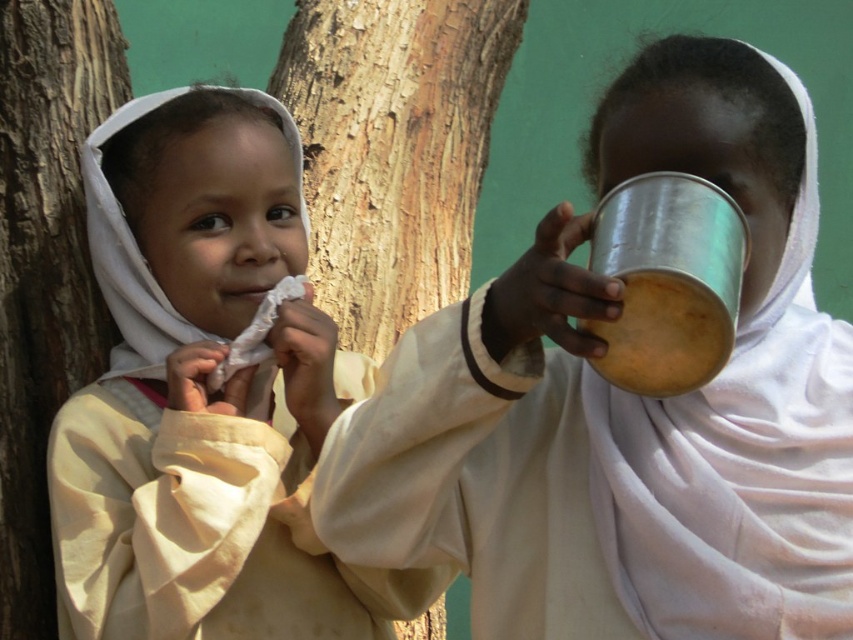
Question: Does light beige cloth at left have a greater width compared to smooth brown bark at left?

Choices:
 (A) yes
 (B) no

Answer: (A)

Question: Which object is the closest to the metallic cup at right?

Choices:
 (A) light beige cloth at left
 (B) rough bark tree at left
 (C) smooth brown bark at left

Answer: (A)

Question: Does metallic cup at right appear on the right side of smooth brown bark at left?

Choices:
 (A) no
 (B) yes

Answer: (B)

Question: Can you confirm if metallic cup at right is positioned to the right of rough bark tree at left?

Choices:
 (A) no
 (B) yes

Answer: (B)

Question: Estimate the real-world distances between objects in this image. Which object is farther from the smooth brown bark at left?

Choices:
 (A) rough bark tree at left
 (B) light beige cloth at left
 (C) metallic cup at right

Answer: (C)

Question: Which point appears farthest from the camera in this image?

Choices:
 (A) (502, 81)
 (B) (755, 593)
 (C) (206, 406)

Answer: (A)